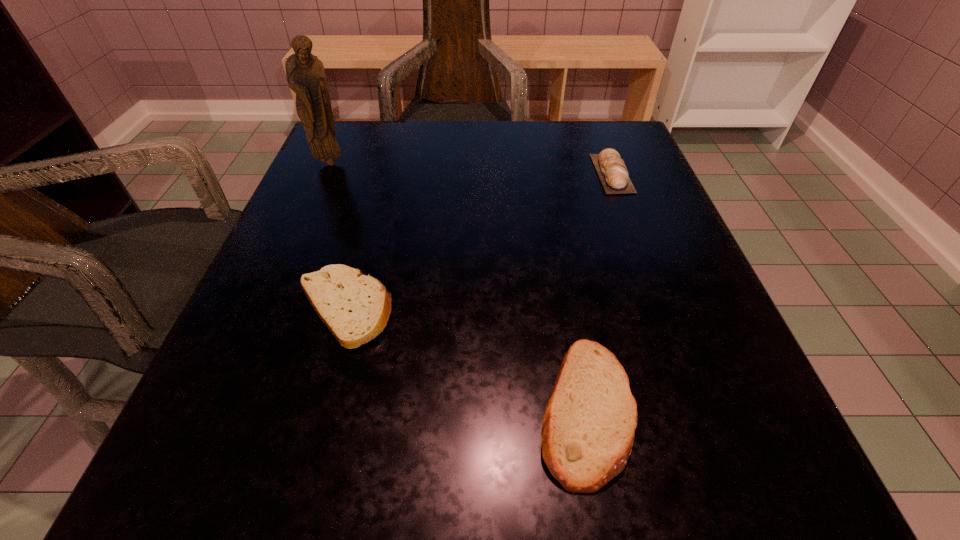
Find the location of `free location that satisfies the following two spatial constraints: 1. on the front-facing side of the tallest object; 2. on the left side of the farthest pita bread`. free location that satisfies the following two spatial constraints: 1. on the front-facing side of the tallest object; 2. on the left side of the farthest pita bread is located at coordinates (325, 173).

The image size is (960, 540). I want to click on vacant space that satisfies the following two spatial constraints: 1. on the front-facing side of the leftmost pita bread; 2. on the right side of the tallest object, so click(x=266, y=309).

The width and height of the screenshot is (960, 540). I want to click on vacant region that satisfies the following two spatial constraints: 1. on the front-facing side of the figurine; 2. on the left side of the leftmost pita bread, so click(x=266, y=309).

Identify the location of free location that satisfies the following two spatial constraints: 1. on the front-facing side of the figurine; 2. on the right side of the second pita bread from left to right. (223, 409).